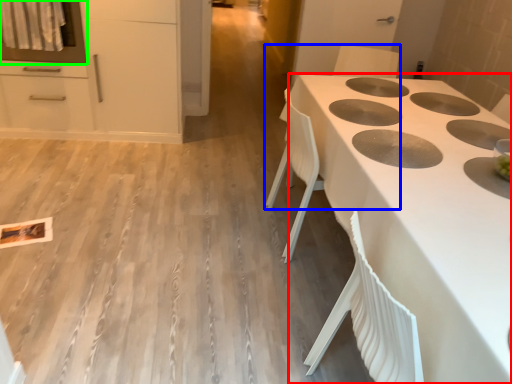
Question: Considering the real-world distances, which object is closest to countertop (highlighted by a red box)? chair (highlighted by a blue box) or oven (highlighted by a green box).

Choices:
 (A) chair
 (B) oven

Answer: (A)